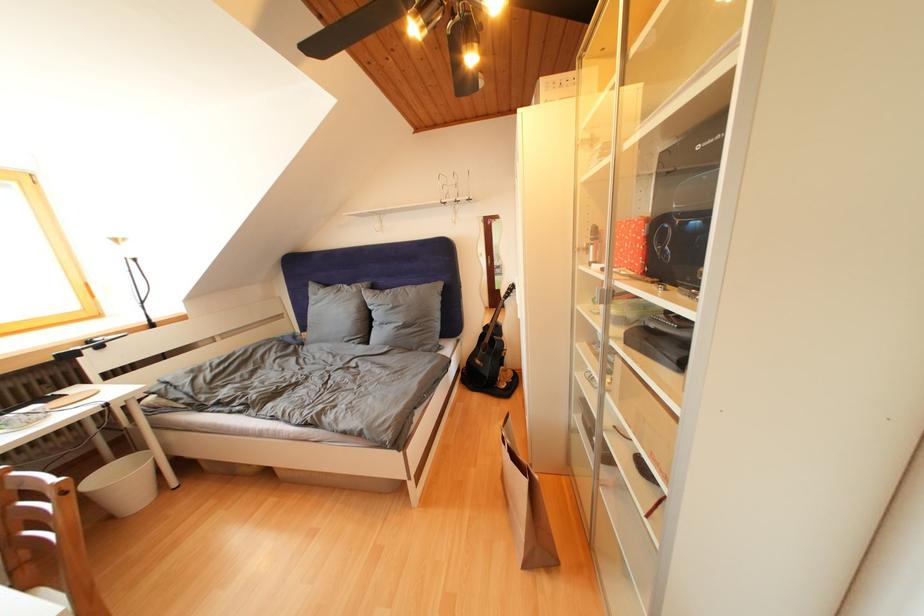
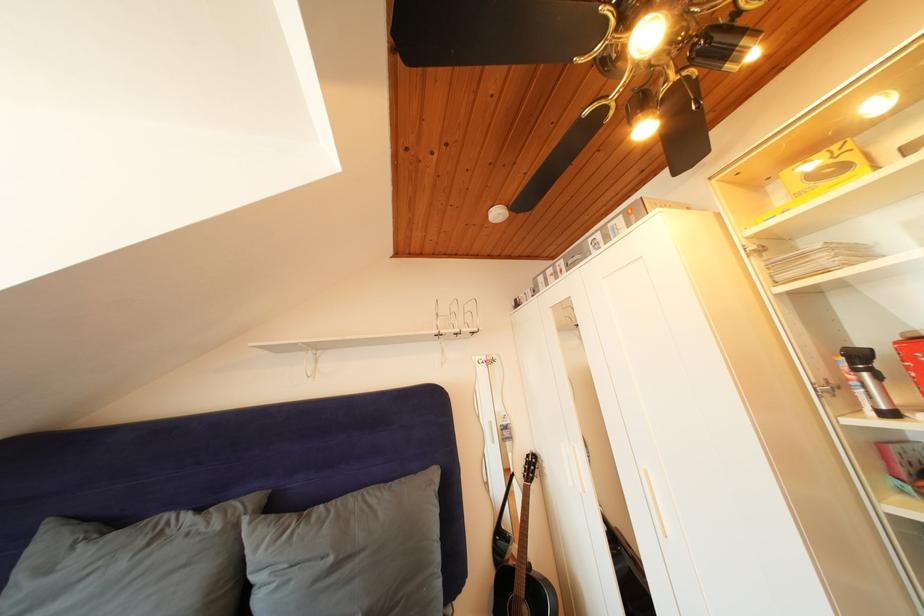
Where in the second image is the point corresponding to [362,294] from the first image?

(225, 531)